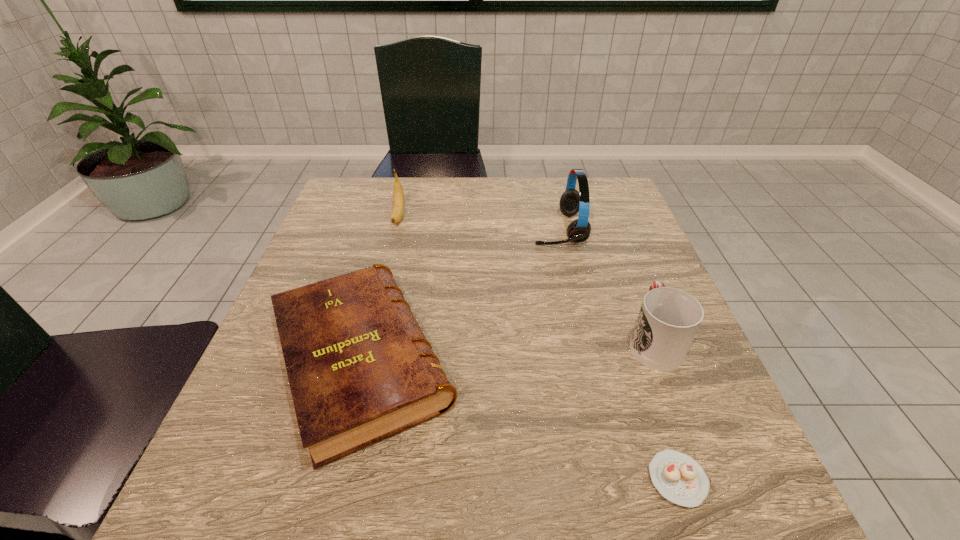
At what (x,y) coordinates should I click in order to perform the action: click on free space located on the handle side of the cup. Please return your answer as a coordinate pair (x, y). The width and height of the screenshot is (960, 540). Looking at the image, I should click on (633, 288).

Identify the location of free space located on the handle side of the cup. (614, 241).

Find the location of a particular element. vacant space located on the front of the hardback book is located at coordinates (324, 507).

Image resolution: width=960 pixels, height=540 pixels. What are the coordinates of `free location located 0.360m on the left of the shortest object` in the screenshot? It's located at (400, 480).

What are the coordinates of `headset located at the far edge` in the screenshot? It's located at (571, 202).

Where is `banana at the far edge`? banana at the far edge is located at coordinates (398, 208).

Locate an element on the screen. Image resolution: width=960 pixels, height=540 pixels. hardback book situated at the near edge is located at coordinates (360, 369).

Locate an element on the screen. cupcake located in the near edge section of the desktop is located at coordinates (678, 477).

At what (x,y) coordinates should I click in order to perform the action: click on object that is positioned at the left edge. Please return your answer as a coordinate pair (x, y). Looking at the image, I should click on (360, 369).

Where is `headset present at the right edge`? headset present at the right edge is located at coordinates (571, 202).